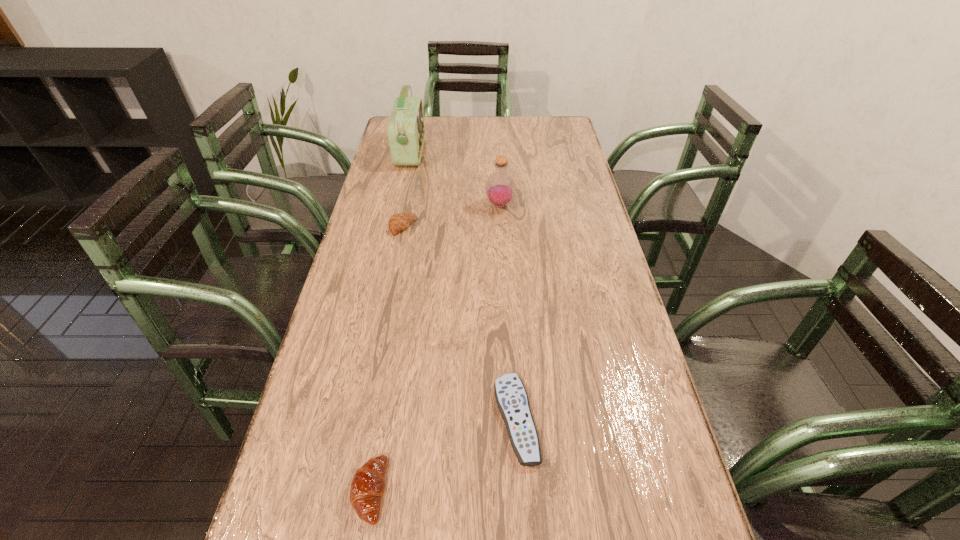
Choose which object is the third nearest neighbor to the farther crescent roll. Please provide its 2D coordinates. Your answer should be formatted as a tuple, i.e. [(x, y)], where the tuple contains the x and y coordinates of a point satisfying the conditions above.

[(512, 400)]

What are the coordinates of `object that is the third closest to the farther crescent roll` in the screenshot? It's located at (512, 400).

I want to click on free spot that satisfies the following two spatial constraints: 1. on the front panel of the radio receiver; 2. on the left side of the bottle, so click(x=399, y=205).

The height and width of the screenshot is (540, 960). Identify the location of vacant region that satisfies the following two spatial constraints: 1. on the front panel of the second tallest object; 2. on the right side of the tallest object. (399, 205).

Where is `free space that satisfies the following two spatial constraints: 1. on the front panel of the remote control; 2. on the left side of the tallest object`? This screenshot has width=960, height=540. free space that satisfies the following two spatial constraints: 1. on the front panel of the remote control; 2. on the left side of the tallest object is located at coordinates (352, 420).

The height and width of the screenshot is (540, 960). I want to click on free space that satisfies the following two spatial constraints: 1. on the front panel of the farthest object; 2. on the back side of the bottle, so click(x=399, y=205).

Identify the location of vacant space that satisfies the following two spatial constraints: 1. on the front panel of the radio receiver; 2. on the left side of the shortest object. (352, 420).

The image size is (960, 540). Find the location of `vacant space that satisfies the following two spatial constraints: 1. on the front panel of the farthest object; 2. on the right side of the remote control`. vacant space that satisfies the following two spatial constraints: 1. on the front panel of the farthest object; 2. on the right side of the remote control is located at coordinates (352, 420).

Locate an element on the screen. This screenshot has height=540, width=960. vacant region that satisfies the following two spatial constraints: 1. on the front panel of the tallest object; 2. on the left side of the third farthest object is located at coordinates (395, 226).

Where is `free space that satisfies the following two spatial constraints: 1. on the front side of the remote control; 2. on the left side of the third farthest object`? The height and width of the screenshot is (540, 960). free space that satisfies the following two spatial constraints: 1. on the front side of the remote control; 2. on the left side of the third farthest object is located at coordinates (365, 420).